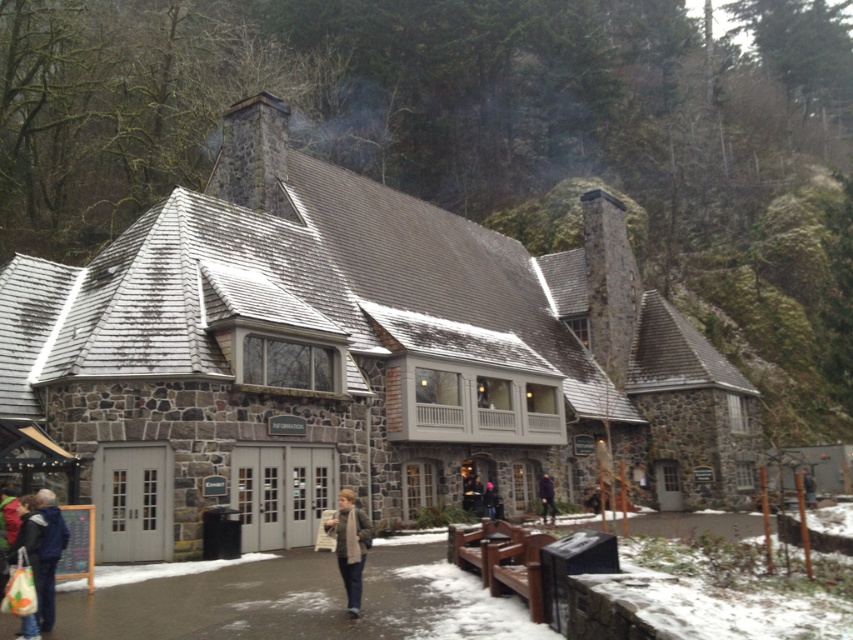
You are standing in front of the stone building and want to determine the relative positions of two points marked on the building. Which point is closer to you, point 1 at coordinates (355, 541) or point 2 at coordinates (555, 512)?

Point 1 at coordinates (355, 541) is closer to you than point 2 at coordinates (555, 512).

Consider the image. You are a traveler approaching the stone building and see the green wool scarf at center and the purple matte jacket at center. Which item is covering the other?

The green wool scarf at center is positioned over the purple matte jacket at center, so it is covering it.